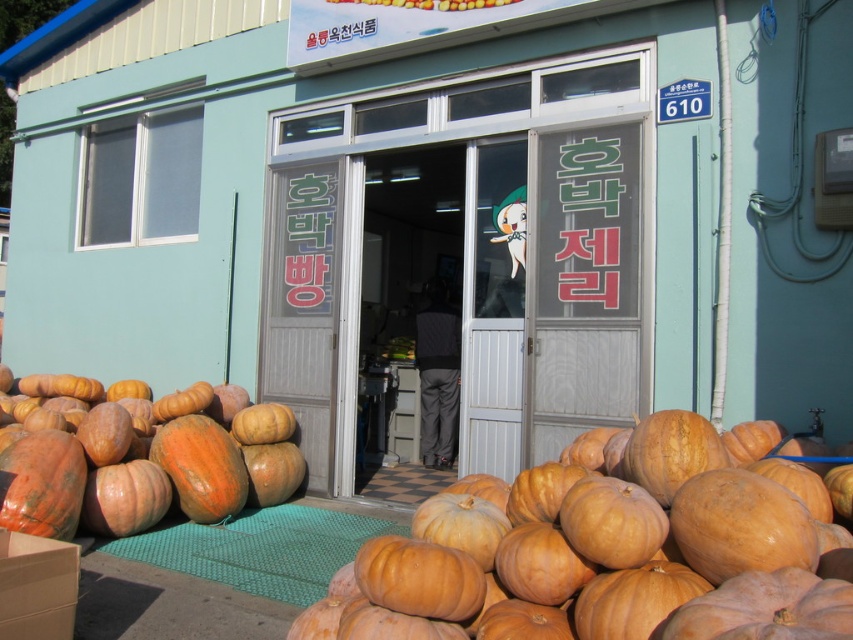
Between smooth glass door at center and orange matte pumpkin at lower center, which one is positioned lower?

orange matte pumpkin at lower center

Does smooth glass door at center have a smaller size compared to orange matte pumpkin at lower center?

Yes, smooth glass door at center is smaller than orange matte pumpkin at lower center.

Between point (531, 65) and point (752, 493), which one is positioned behind?

Point (531, 65)

Locate an element on the screen. Image resolution: width=853 pixels, height=640 pixels. smooth glass door at center is located at coordinates (467, 257).

What do you see at coordinates (467, 257) in the screenshot? The image size is (853, 640). I see `smooth glass door at center` at bounding box center [467, 257].

Is smooth glass door at center taller than orange matte pumpkin at center?

Indeed, smooth glass door at center has a greater height compared to orange matte pumpkin at center.

I want to click on smooth glass door at center, so click(x=467, y=257).

Which is below, orange matte pumpkin at lower center or orange matte pumpkin at center?

orange matte pumpkin at lower center

Can you confirm if orange matte pumpkin at lower center is positioned to the right of orange matte pumpkin at center?

Yes, orange matte pumpkin at lower center is to the right of orange matte pumpkin at center.

I want to click on orange matte pumpkin at lower center, so click(601, 561).